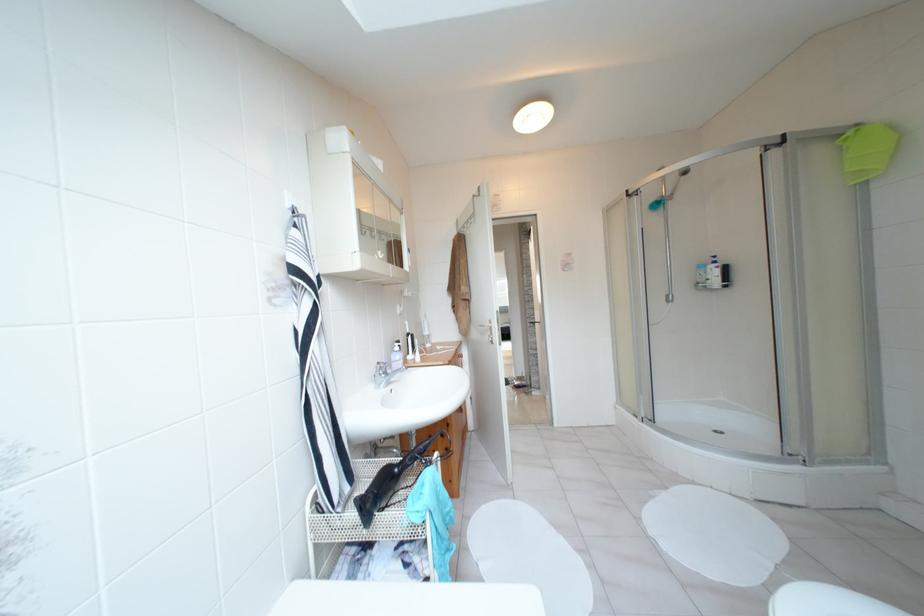
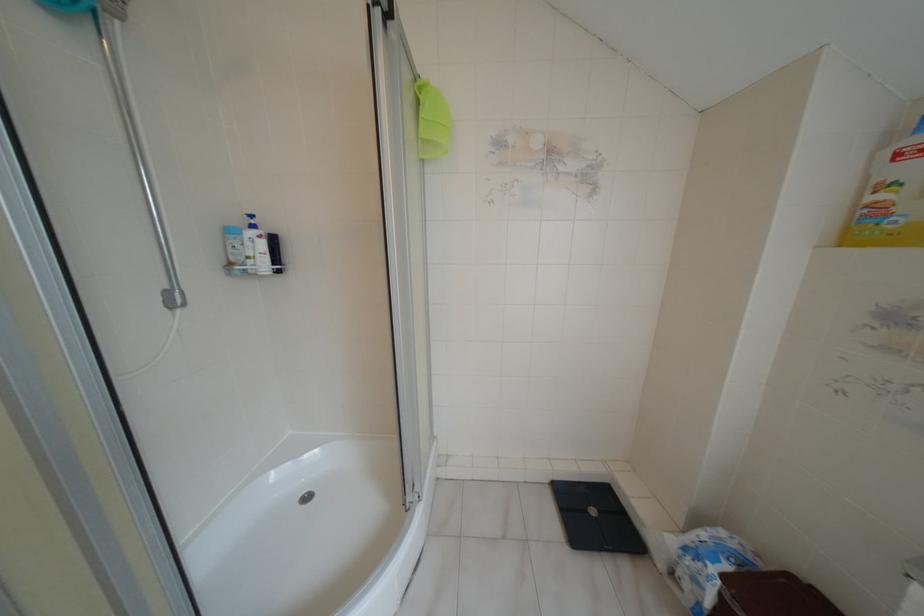
The point at (666,294) is marked in the first image. Where is the corresponding point in the second image?

(166, 293)